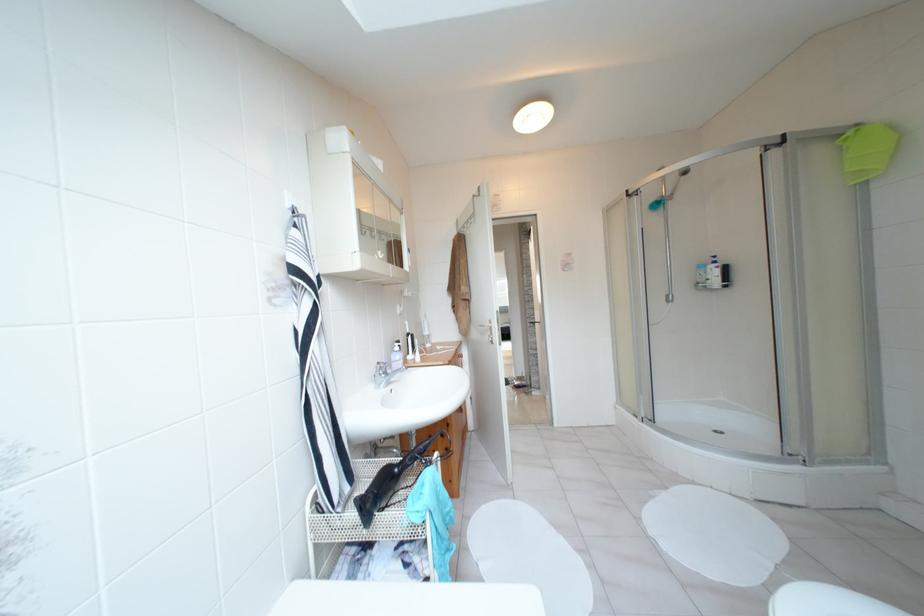
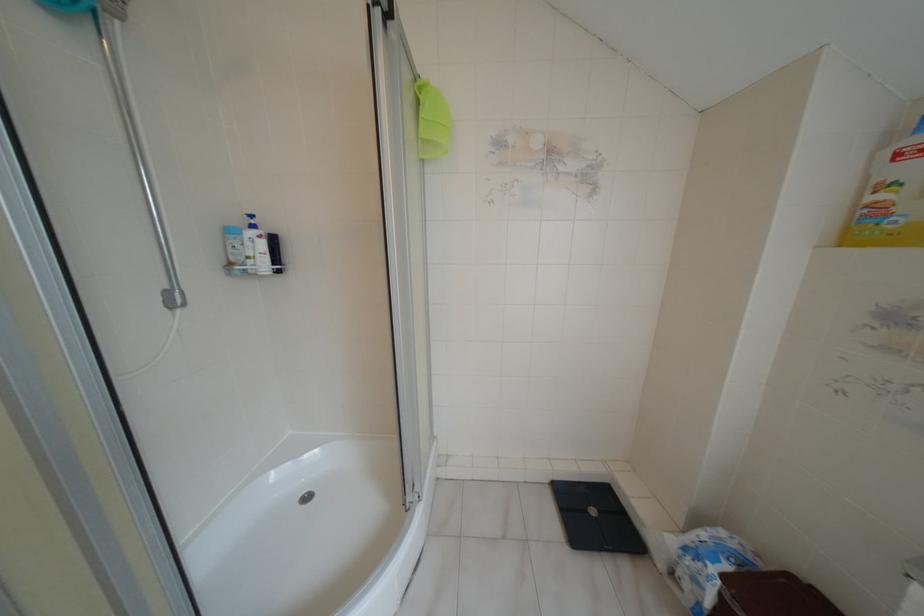
The point at (666,294) is marked in the first image. Where is the corresponding point in the second image?

(166, 293)